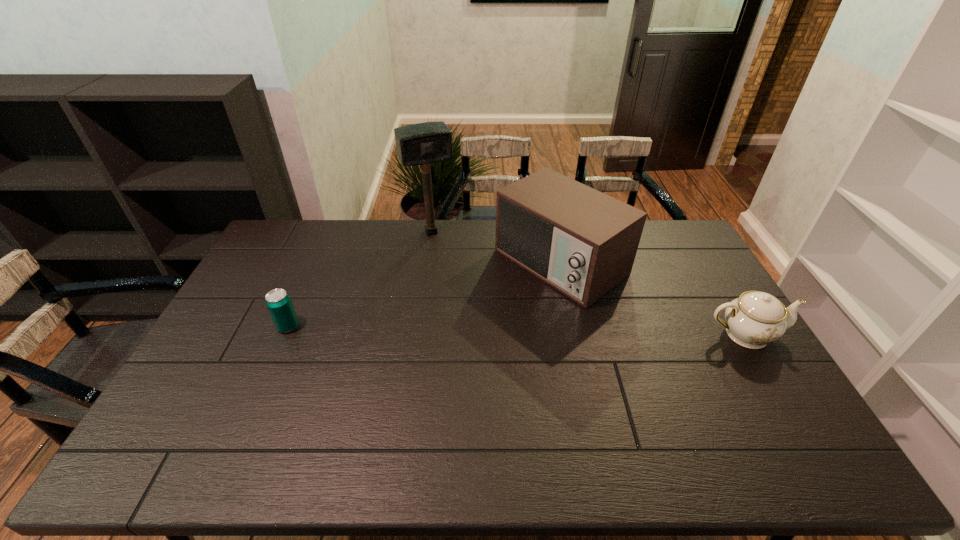
The width and height of the screenshot is (960, 540). What are the coordinates of `the shortest object` in the screenshot? It's located at (278, 302).

This screenshot has height=540, width=960. I want to click on beer can, so click(278, 302).

Find the location of a particular element. the rightmost object is located at coordinates (753, 320).

The width and height of the screenshot is (960, 540). I want to click on chinaware, so click(753, 320).

Locate an element on the screen. the third object from left to right is located at coordinates 582,242.

Locate an element on the screen. Image resolution: width=960 pixels, height=540 pixels. radio receiver is located at coordinates (582, 242).

This screenshot has height=540, width=960. In order to click on the tallest object in this screenshot , I will do `click(424, 143)`.

Locate an element on the screen. The width and height of the screenshot is (960, 540). mallet is located at coordinates (424, 143).

Identify the location of blank area located 0.060m on the front of the beer can. The width and height of the screenshot is (960, 540). (277, 350).

You are a GUI agent. You are given a task and a screenshot of the screen. Output one action in this format:
    pyautogui.click(x=<x>, y=<y>)
    Task: Click on the vacant space situated on the front-facing side of the second tallest object
    Image resolution: width=960 pixels, height=540 pixels.
    Given the screenshot: What is the action you would take?
    pyautogui.click(x=487, y=311)